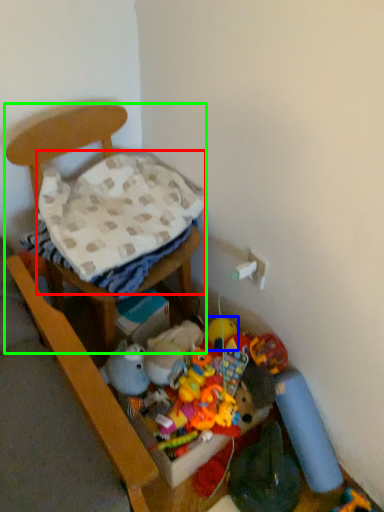
Question: Which object is the closest to the blanket (highlighted by a red box)? Choose among these: toy (highlighted by a blue box) or furniture (highlighted by a green box).

Choices:
 (A) toy
 (B) furniture

Answer: (B)